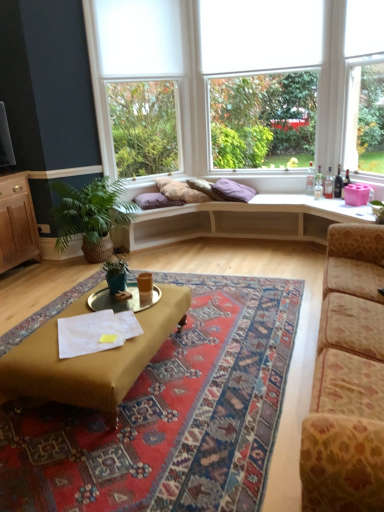
Where is `free space underneath light wood futon at center (from a real-world perspective)`? The width and height of the screenshot is (384, 512). free space underneath light wood futon at center (from a real-world perspective) is located at coordinates (253, 252).